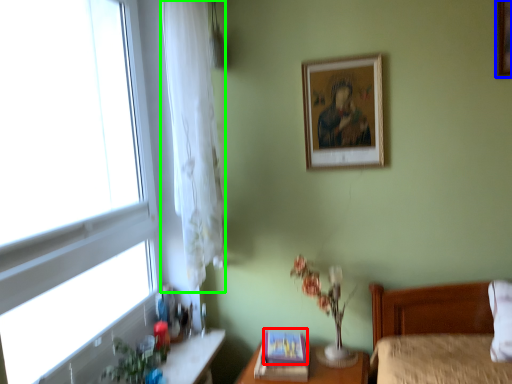
Question: Based on their relative distances, which object is nearer to picture frame (highlighted by a red box)? Choose from picture frame (highlighted by a blue box) and curtain (highlighted by a green box).

Choices:
 (A) picture frame
 (B) curtain

Answer: (B)